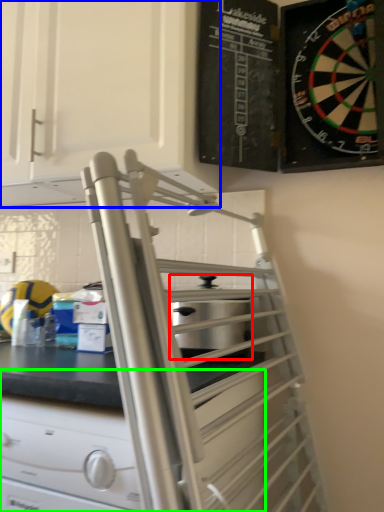
Question: Which object is positioned closest to appliance (highlighted by a red box)? Select from cabinetry (highlighted by a blue box) and drawer (highlighted by a green box).

Choices:
 (A) cabinetry
 (B) drawer

Answer: (B)